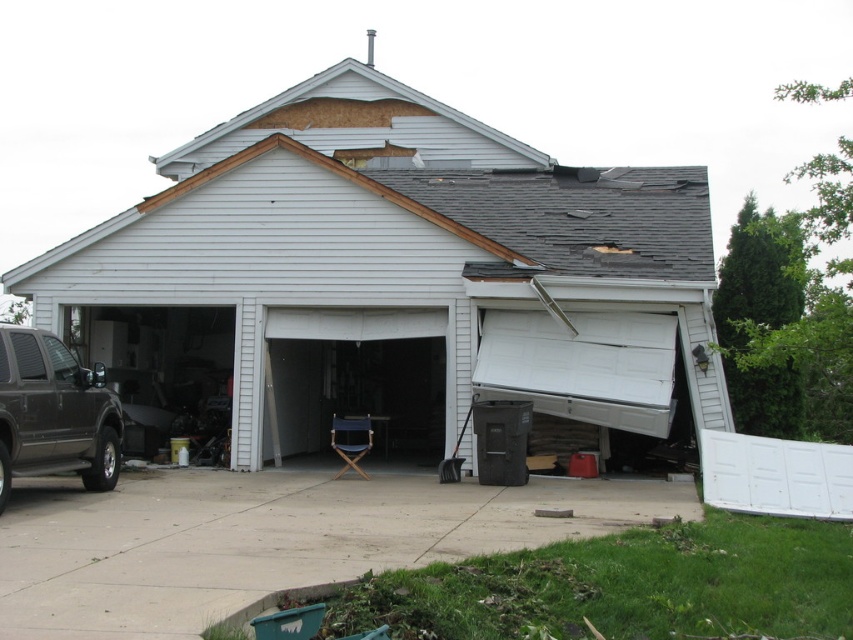
Question: Estimate the real-world distances between objects in this image. Which object is farther from the matte black suv at lower left?

Choices:
 (A) white matte garage door at center
 (B) transparent plastic chair at center

Answer: (A)

Question: Does white matte garage door at center appear on the right side of transparent plastic chair at center?

Choices:
 (A) yes
 (B) no

Answer: (B)

Question: Estimate the real-world distances between objects in this image. Which object is farther from the matte black suv at lower left?

Choices:
 (A) white matte garage door at center
 (B) transparent plastic chair at center

Answer: (A)

Question: Considering the real-world distances, which object is closest to the transparent plastic chair at center?

Choices:
 (A) white matte garage door at center
 (B) concrete at lower center
 (C) matte black suv at lower left

Answer: (A)

Question: Can you confirm if white matte garage door at center is smaller than matte black suv at lower left?

Choices:
 (A) no
 (B) yes

Answer: (A)

Question: Can you confirm if concrete at lower center is positioned below transparent plastic chair at center?

Choices:
 (A) yes
 (B) no

Answer: (A)